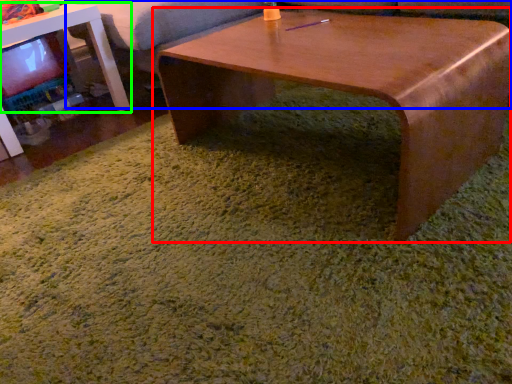
Question: Which object is positioned closest to coffee table (highlighted by a red box)? Select from couch (highlighted by a blue box) and table (highlighted by a green box).

Choices:
 (A) couch
 (B) table

Answer: (A)